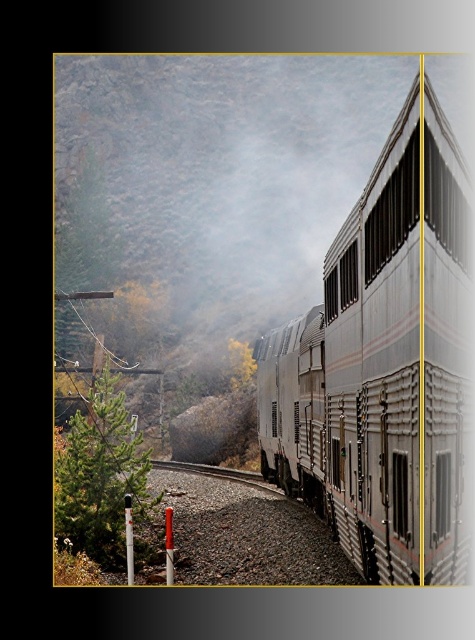
Who is more distant from viewer, (371,227) or (63,492)?

Point (63,492)

Which of these two, silver metallic train at center or green matte tree at lower left, stands shorter?

Standing shorter between the two is green matte tree at lower left.

What do you see at coordinates (383, 364) in the screenshot? I see `silver metallic train at center` at bounding box center [383, 364].

Where is `silver metallic train at center`? The height and width of the screenshot is (640, 475). silver metallic train at center is located at coordinates (383, 364).